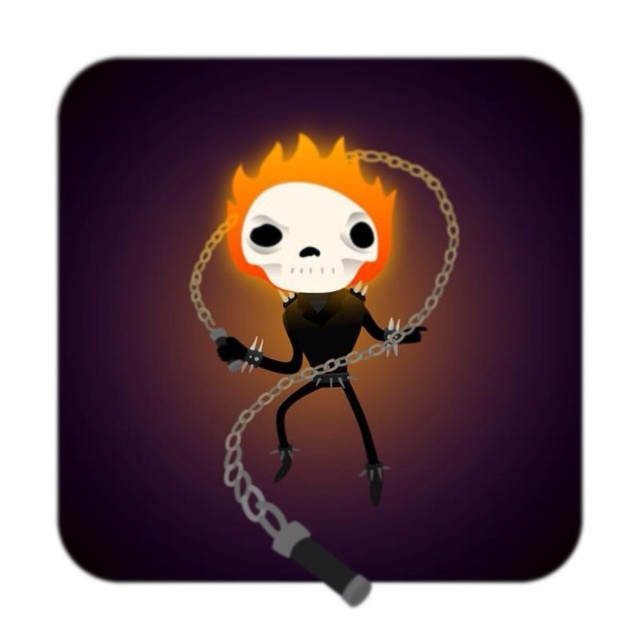
Question: Is translucent white skull at center above metallic chain at center?

Choices:
 (A) no
 (B) yes

Answer: (B)

Question: Which point appears closest to the camera in this image?

Choices:
 (A) (256, 499)
 (B) (147, 524)

Answer: (A)

Question: Does translucent white skull at center appear on the right side of metallic chain at center?

Choices:
 (A) no
 (B) yes

Answer: (B)

Question: Which point is farther to the camera?

Choices:
 (A) metallic chain at center
 (B) translucent white skull at center

Answer: (B)

Question: Does translucent white skull at center appear under metallic chain at center?

Choices:
 (A) yes
 (B) no

Answer: (B)